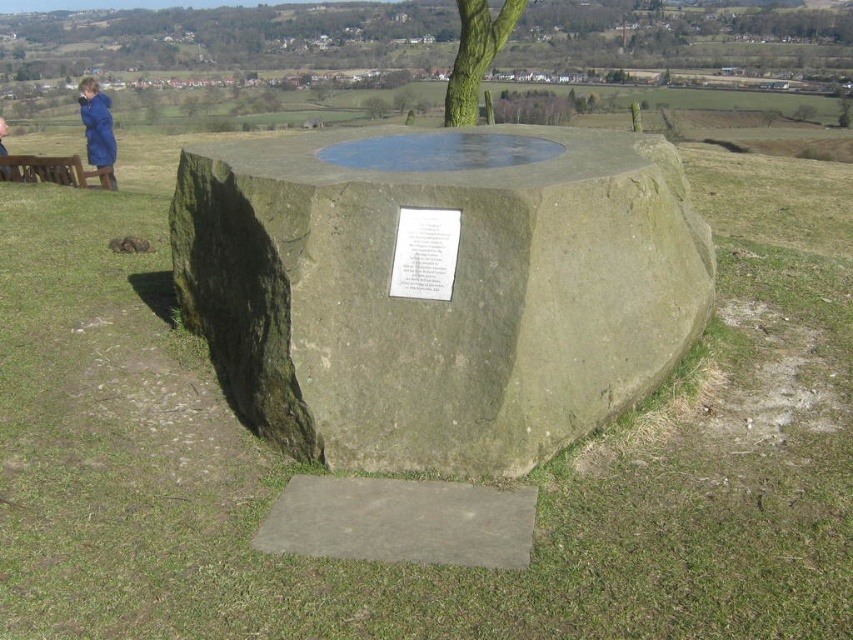
The image size is (853, 640). Describe the element at coordinates (438, 288) in the screenshot. I see `green stone monument at center` at that location.

Can you confirm if green stone monument at center is shorter than green textured tree at upper center?

Incorrect, green stone monument at center's height does not fall short of green textured tree at upper center's.

The width and height of the screenshot is (853, 640). I want to click on green stone monument at center, so click(x=438, y=288).

Where is `green stone monument at center`? green stone monument at center is located at coordinates (438, 288).

Which is more to the left, green stone monument at center or brown wooden bench at left?

brown wooden bench at left

Who is shorter, green stone monument at center or brown wooden bench at left?

Standing shorter between the two is brown wooden bench at left.

Is point (381, 289) in front of point (94, 172)?

Yes, point (381, 289) is in front of point (94, 172).

Locate an element on the screen. The height and width of the screenshot is (640, 853). green stone monument at center is located at coordinates (438, 288).

Who is lower down, green textured tree at upper center or brown wooden bench at left?

brown wooden bench at left is lower down.

Identify the location of green textured tree at upper center. The height and width of the screenshot is (640, 853). (476, 54).

Locate an element on the screen. The image size is (853, 640). green textured tree at upper center is located at coordinates (476, 54).

Find the location of `green textured tree at upper center`. green textured tree at upper center is located at coordinates (476, 54).